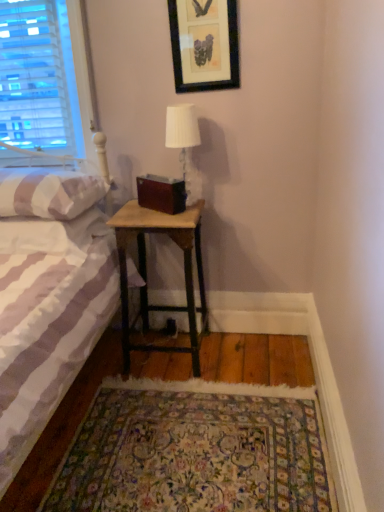
Question: Is white fabric lampshade at upper center further to the viewer compared to white striped fabric bed at left?

Choices:
 (A) yes
 (B) no

Answer: (A)

Question: Does white fabric lampshade at upper center appear on the right side of white striped fabric bed at left?

Choices:
 (A) yes
 (B) no

Answer: (A)

Question: Is white fabric lampshade at upper center positioned before white striped fabric bed at left?

Choices:
 (A) yes
 (B) no

Answer: (B)

Question: From the image's perspective, is white fabric lampshade at upper center under white striped fabric bed at left?

Choices:
 (A) no
 (B) yes

Answer: (A)

Question: Is white striped fabric bed at left surrounded by white fabric lampshade at upper center?

Choices:
 (A) no
 (B) yes

Answer: (A)

Question: Considering their positions, is white striped pillow at left located in front of or behind white striped fabric bed at left?

Choices:
 (A) behind
 (B) front

Answer: (A)

Question: Looking at their shapes, would you say white striped pillow at left is wider or thinner than white striped fabric bed at left?

Choices:
 (A) thin
 (B) wide

Answer: (A)

Question: From a real-world perspective, is white striped pillow at left physically located above or below white striped fabric bed at left?

Choices:
 (A) below
 (B) above

Answer: (B)

Question: Looking at the image, does white striped pillow at left seem bigger or smaller compared to white striped fabric bed at left?

Choices:
 (A) small
 (B) big

Answer: (A)

Question: Choose the correct answer: Is black framed picture at upper center inside white striped pillow at left or outside it?

Choices:
 (A) inside
 (B) outside

Answer: (B)

Question: In terms of height, does black framed picture at upper center look taller or shorter compared to white striped pillow at left?

Choices:
 (A) tall
 (B) short

Answer: (A)

Question: From a real-world perspective, relative to white striped pillow at left, is black framed picture at upper center vertically above or below?

Choices:
 (A) below
 (B) above

Answer: (B)

Question: In the image, is black framed picture at upper center on the left side or the right side of white striped pillow at left?

Choices:
 (A) left
 (B) right

Answer: (B)

Question: From the image's perspective, is white fabric lampshade at upper center above or below white striped fabric bed at left?

Choices:
 (A) below
 (B) above

Answer: (B)

Question: Is white fabric lampshade at upper center wider or thinner than white striped fabric bed at left?

Choices:
 (A) wide
 (B) thin

Answer: (B)